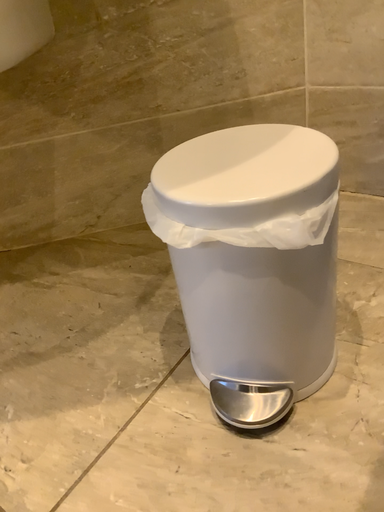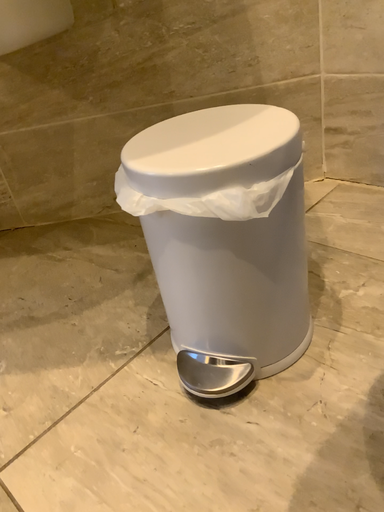
Question: Which way did the camera rotate in the video?

Choices:
 (A) rotated right
 (B) rotated left

Answer: (B)